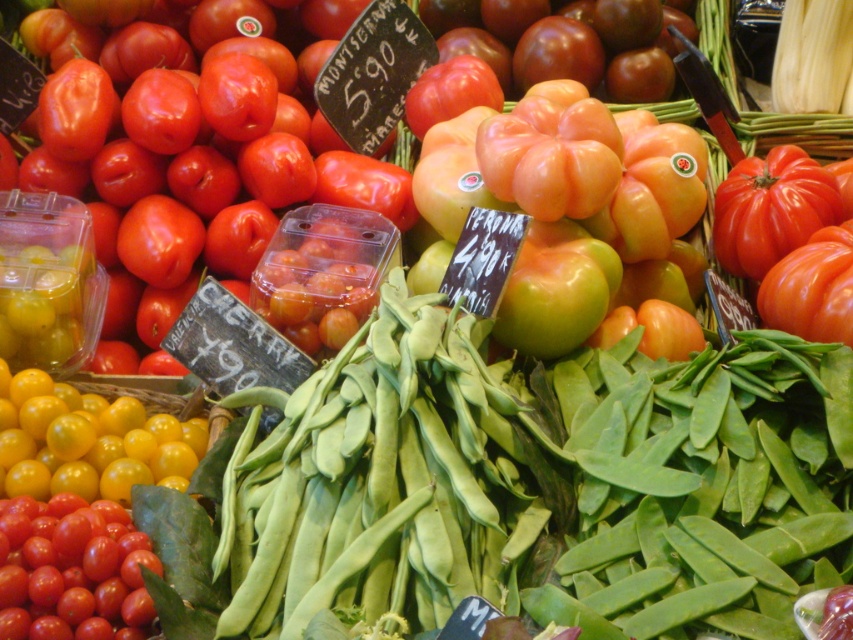
In the scene shown: Is glossy cherry tomatoes at center to the right of shiny red cherry tomatoes at lower left from the viewer's perspective?

Yes, glossy cherry tomatoes at center is to the right of shiny red cherry tomatoes at lower left.

Is point (286, 337) closer to camera compared to point (78, 620)?

No, it is not.

Find the location of a particular element. The image size is (853, 640). glossy cherry tomatoes at center is located at coordinates (190, 172).

Is glossy cherry tomatoes at center to the left of orange matte tomato at center from the viewer's perspective?

Indeed, glossy cherry tomatoes at center is positioned on the left side of orange matte tomato at center.

Who is positioned more to the right, glossy cherry tomatoes at center or orange matte tomato at center?

orange matte tomato at center is more to the right.

Identify the location of glossy cherry tomatoes at center. (190, 172).

Does orange matte tomato at center have a larger size compared to shiny red cherry tomatoes at lower left?

Yes.

Is orange matte tomato at center positioned at the back of shiny red cherry tomatoes at lower left?

Yes, it is.

The width and height of the screenshot is (853, 640). What do you see at coordinates (567, 209) in the screenshot?
I see `orange matte tomato at center` at bounding box center [567, 209].

I want to click on orange matte tomato at center, so 567,209.